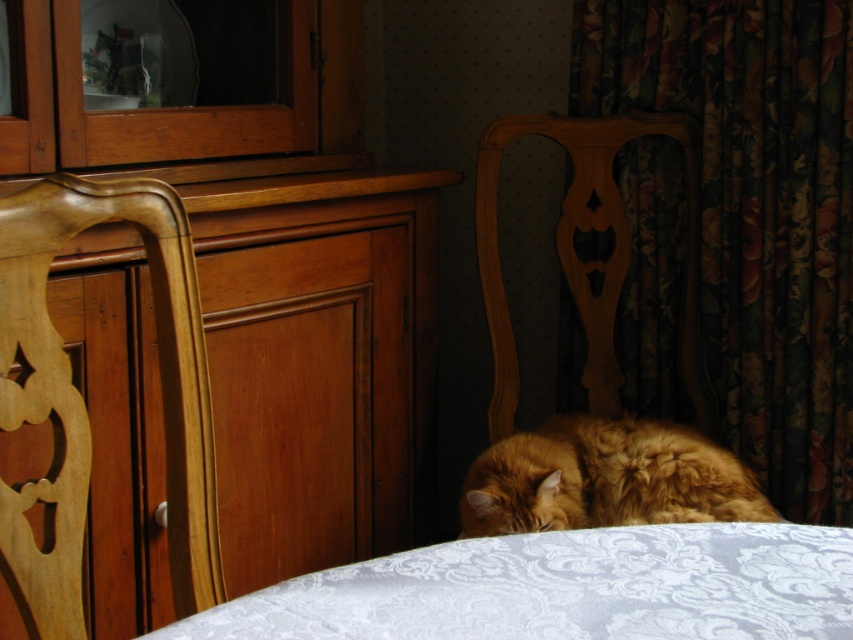
You are arranging flowers in a vase. The wooden dresser at left and the white damask fabric at lower center are in your view. Which object is taller?

The wooden dresser at left is taller than the white damask fabric at lower center.

You are a delivery person trying to place a package that is 28 inches wide between the wooden dresser at left and the white damask fabric at lower center. Will the package fit in the space between them?

The wooden dresser at left and white damask fabric at lower center are 27.95 inches apart. Since the package is 28 inches wide, it is slightly wider than the available space. Therefore, the package will not fit between them.